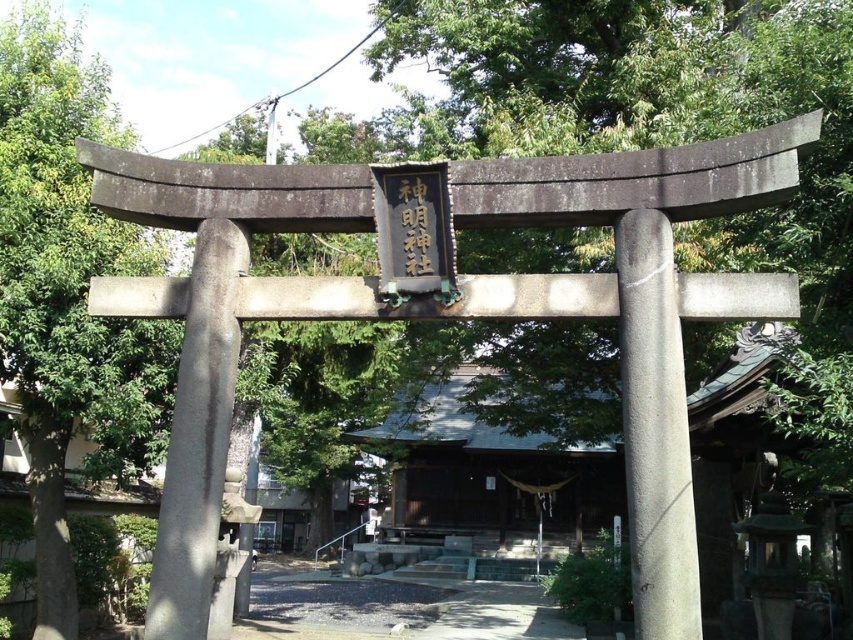
Question: Among these objects, which one is farthest from the camera?

Choices:
 (A) gray concrete pillar at left
 (B) black wood sign at center
 (C) gray stone pillar at center

Answer: (B)

Question: Is gray concrete pillar at left above black wood sign at center?

Choices:
 (A) yes
 (B) no

Answer: (B)

Question: Where is gray concrete pillar at left located in relation to black wood sign at center in the image?

Choices:
 (A) left
 (B) right

Answer: (A)

Question: Is gray stone pillar at center positioned in front of gray concrete pillar at left?

Choices:
 (A) no
 (B) yes

Answer: (B)

Question: Among these objects, which one is nearest to the camera?

Choices:
 (A) gray stone pillar at center
 (B) gray concrete pillar at left
 (C) black wood sign at center

Answer: (A)

Question: Among these points, which one is farthest from the camera?

Choices:
 (A) pyautogui.click(x=640, y=568)
 (B) pyautogui.click(x=410, y=262)

Answer: (B)